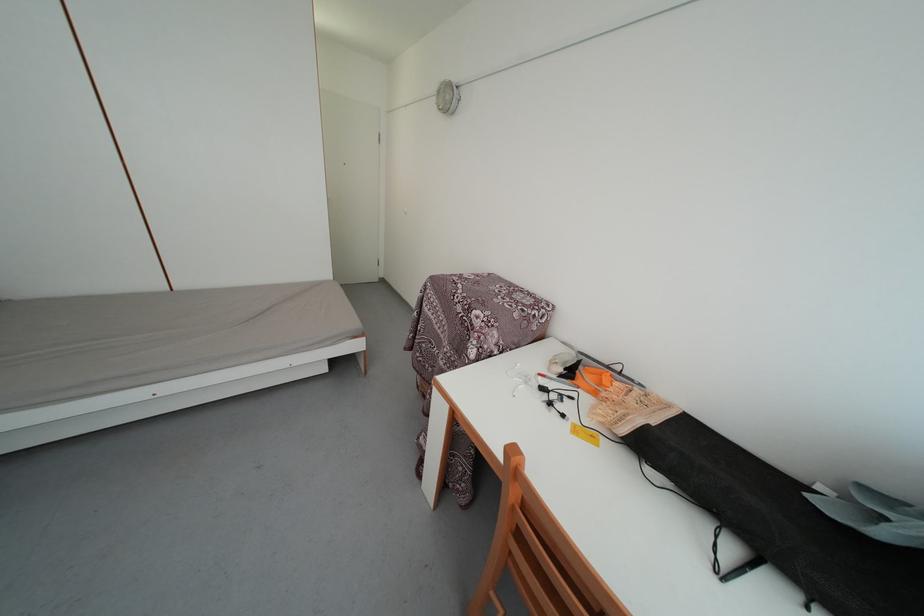
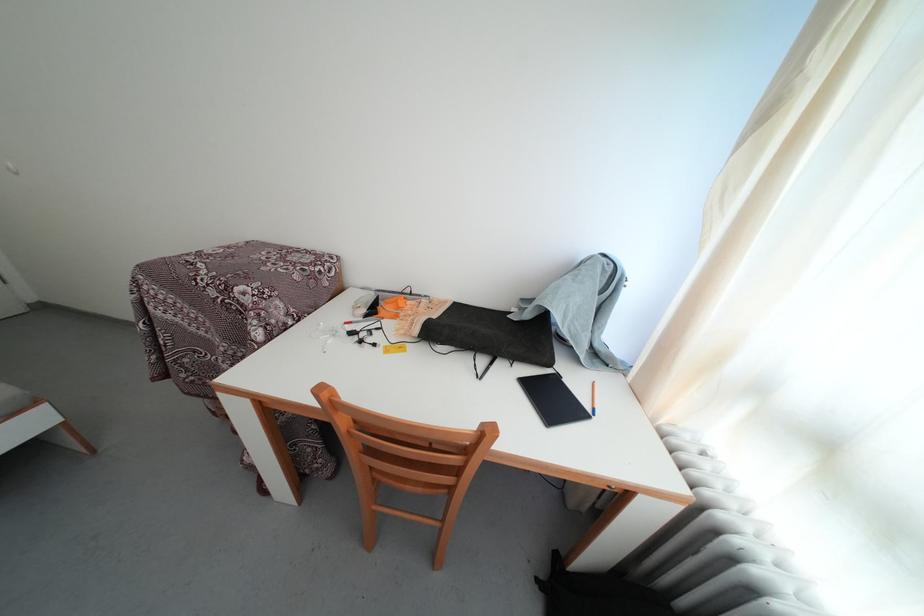
The point at (566, 382) is marked in the first image. Where is the corresponding point in the second image?

(371, 322)